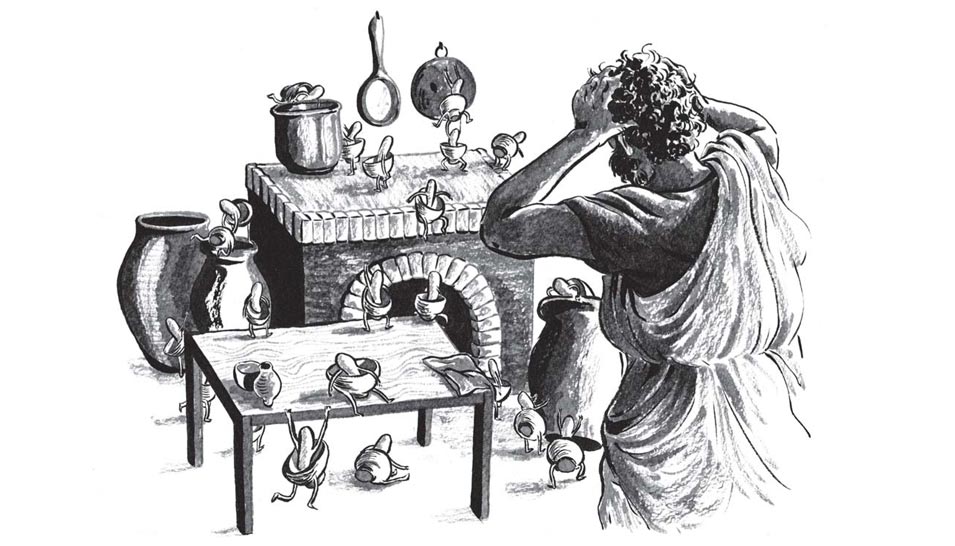
Where is `table`? The image size is (955, 546). table is located at coordinates (323, 360).